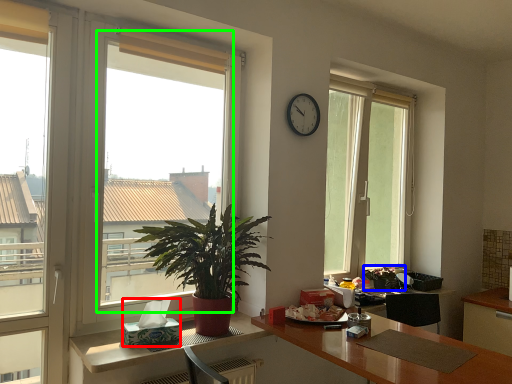
Question: Estimate the real-world distances between objects in this image. Which object is closer to tissue paper (highlighted by a red box), houseplant (highlighted by a blue box) or bay window (highlighted by a green box)?

Choices:
 (A) houseplant
 (B) bay window

Answer: (B)